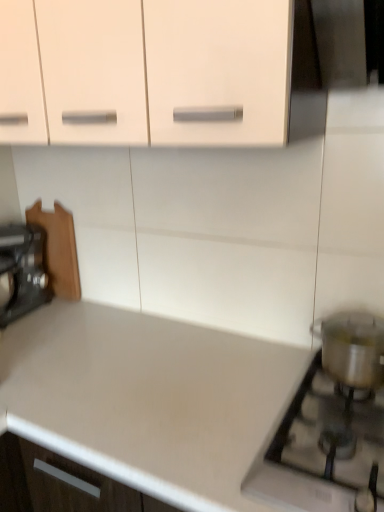
Question: Can you confirm if satin silver pot at lower right is wider than metallic silver pot at right?

Choices:
 (A) yes
 (B) no

Answer: (A)

Question: Can you confirm if satin silver pot at lower right is taller than metallic silver pot at right?

Choices:
 (A) no
 (B) yes

Answer: (A)

Question: Is metallic silver pot at right located within satin silver pot at lower right?

Choices:
 (A) yes
 (B) no

Answer: (B)

Question: Is satin silver pot at lower right at the right side of metallic silver pot at right?

Choices:
 (A) no
 (B) yes

Answer: (A)

Question: Does satin silver pot at lower right come behind metallic silver pot at right?

Choices:
 (A) yes
 (B) no

Answer: (B)

Question: Visually, is wooden cutting board at left positioned to the left or to the right of white matte countertop at lower right?

Choices:
 (A) left
 (B) right

Answer: (A)

Question: Considering the positions of wooden cutting board at left and white matte countertop at lower right in the image, is wooden cutting board at left wider or thinner than white matte countertop at lower right?

Choices:
 (A) thin
 (B) wide

Answer: (A)

Question: From the image's perspective, relative to white matte countertop at lower right, is wooden cutting board at left above or below?

Choices:
 (A) below
 (B) above

Answer: (B)

Question: Is point (26, 272) closer or farther from the camera than point (198, 472)?

Choices:
 (A) closer
 (B) farther

Answer: (B)

Question: Choose the correct answer: Is metallic silver pot at right inside satin silver pot at lower right or outside it?

Choices:
 (A) outside
 (B) inside

Answer: (A)

Question: In the image, is metallic silver pot at right on the left side or the right side of satin silver pot at lower right?

Choices:
 (A) left
 (B) right

Answer: (B)

Question: From their relative heights in the image, would you say metallic silver pot at right is taller or shorter than satin silver pot at lower right?

Choices:
 (A) short
 (B) tall

Answer: (B)

Question: From the image's perspective, is metallic silver pot at right positioned above or below satin silver pot at lower right?

Choices:
 (A) above
 (B) below

Answer: (A)

Question: In the image, is satin silver pot at lower right positioned in front of or behind white matte countertop at lower right?

Choices:
 (A) behind
 (B) front

Answer: (A)

Question: Is satin silver pot at lower right taller or shorter than white matte countertop at lower right?

Choices:
 (A) short
 (B) tall

Answer: (A)